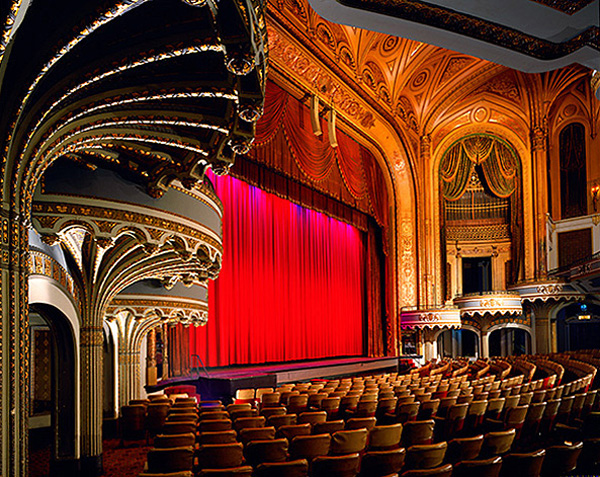
At what (x,y) coordinates should I click in order to perform the action: click on half circles in light brown above red curtains. Please return your answer as a coordinate pair (x, y). The image size is (600, 477). Looking at the image, I should click on (413, 121), (401, 113), (385, 99), (369, 79), (348, 59), (319, 34), (299, 11).